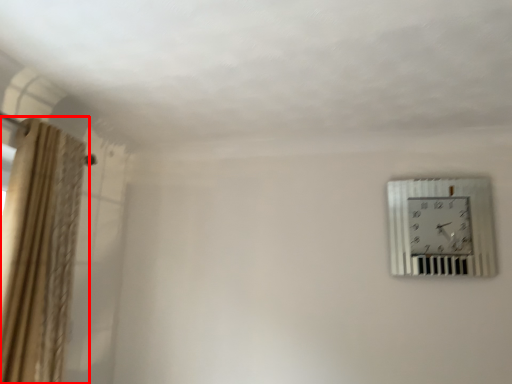
Question: From the image's perspective, what is the correct spatial positioning of curtain (annotated by the red box) in reference to wall clock?

Choices:
 (A) above
 (B) below

Answer: (B)